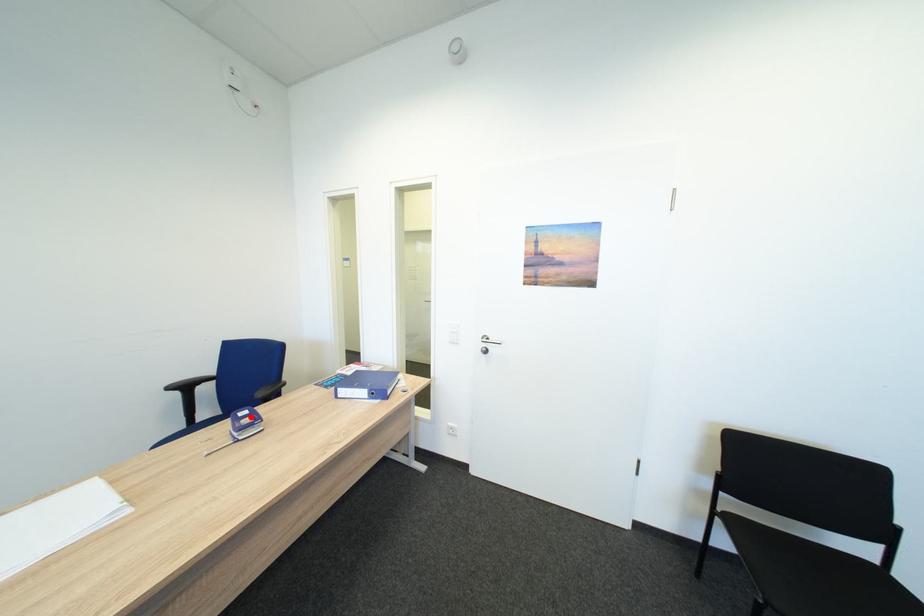
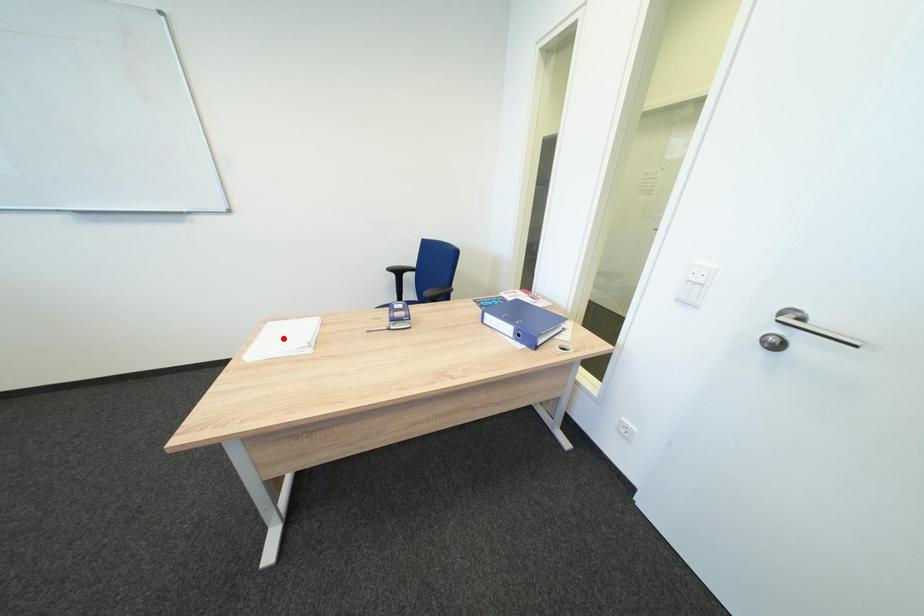
I am providing you with two images of the same scene from different viewpoints. A red point is marked on the first image and another point is marked on the second image. Does the point marked in image1 correspond to the same location as the one in image2?

No